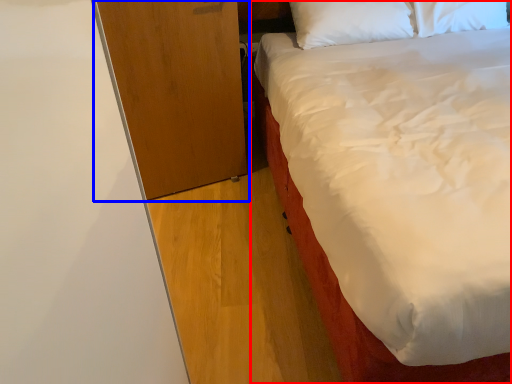
Question: Which point is further to the camera, bed (highlighted by a red box) or dresser (highlighted by a blue box)?

Choices:
 (A) bed
 (B) dresser

Answer: (B)